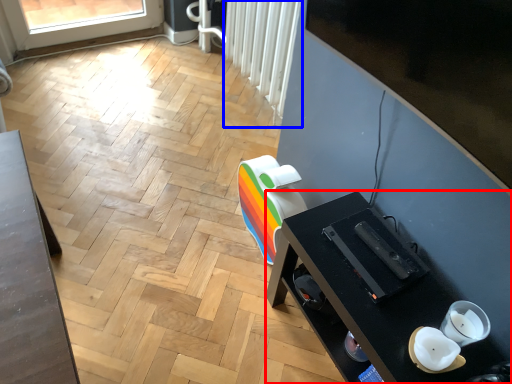
Question: Among these objects, which one is nearest to the camera, desk (highlighted by a red box) or radiator (highlighted by a blue box)?

Choices:
 (A) desk
 (B) radiator

Answer: (A)